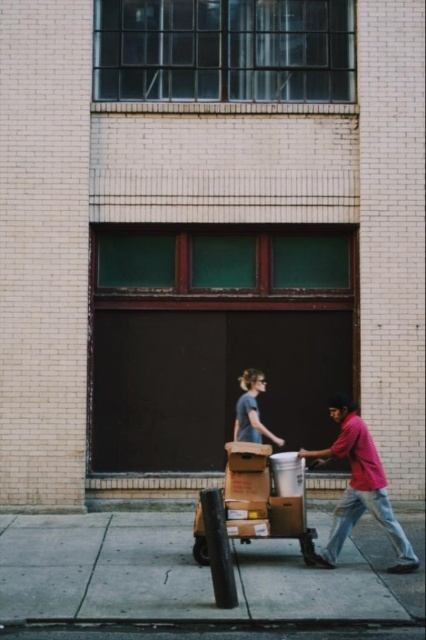
Question: Is pink matte shirt at right wider than matte gray shirt at center?

Choices:
 (A) no
 (B) yes

Answer: (B)

Question: Among these objects, which one is nearest to the camera?

Choices:
 (A) matte black trolley at center
 (B) pink matte shirt at right
 (C) gray concrete sidewalk at lower center

Answer: (C)

Question: Based on their relative distances, which object is farther from the matte gray shirt at center?

Choices:
 (A) gray concrete sidewalk at lower center
 (B) matte black trolley at center
 (C) pink matte shirt at right

Answer: (A)

Question: Which point is farther to the camera?

Choices:
 (A) (249, 509)
 (B) (333, 570)

Answer: (B)

Question: Does matte black trolley at center have a larger size compared to matte gray shirt at center?

Choices:
 (A) no
 (B) yes

Answer: (B)

Question: Is gray concrete sidewalk at lower center further to camera compared to matte gray shirt at center?

Choices:
 (A) yes
 (B) no

Answer: (B)